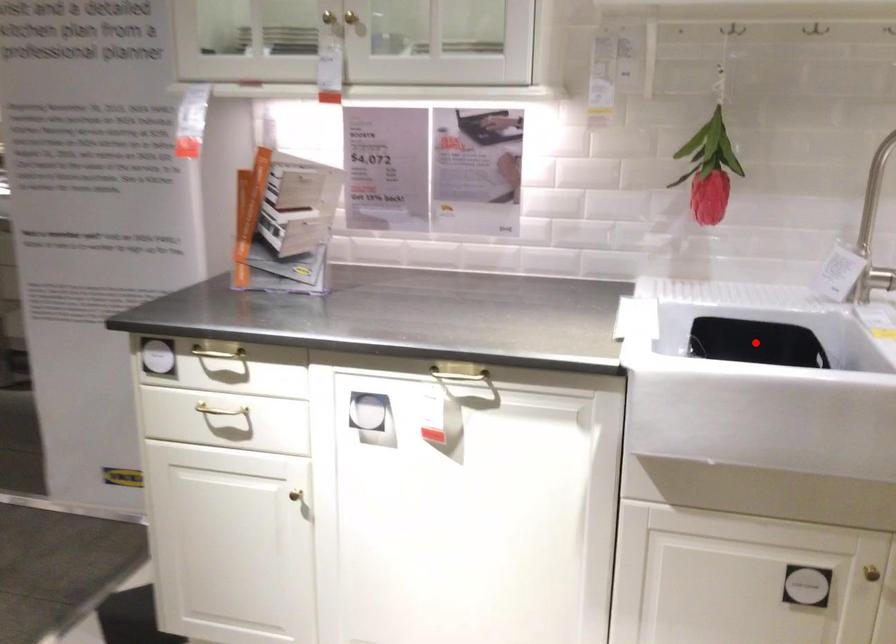
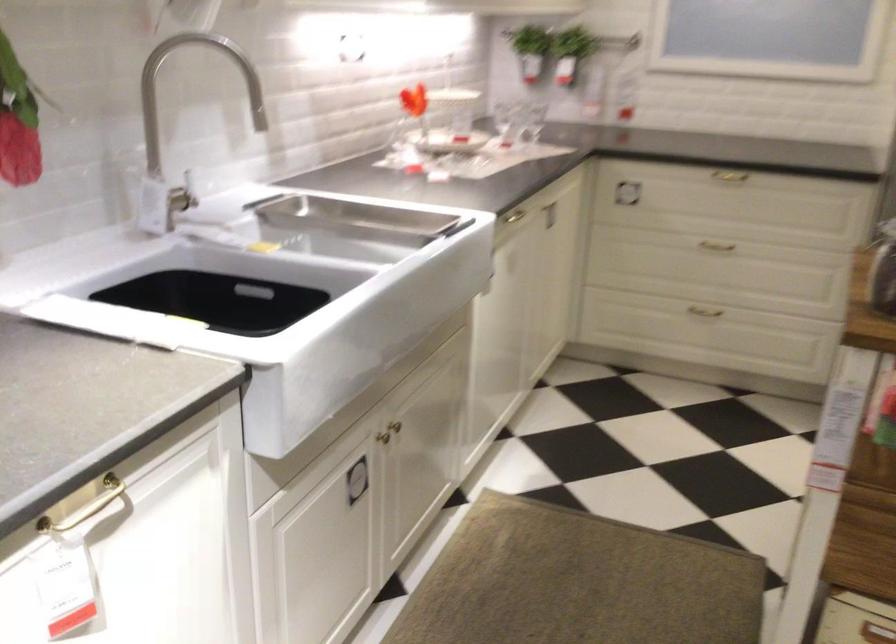
Locate, in the second image, the point that corresponds to the highlighted location in the first image.

(148, 305)